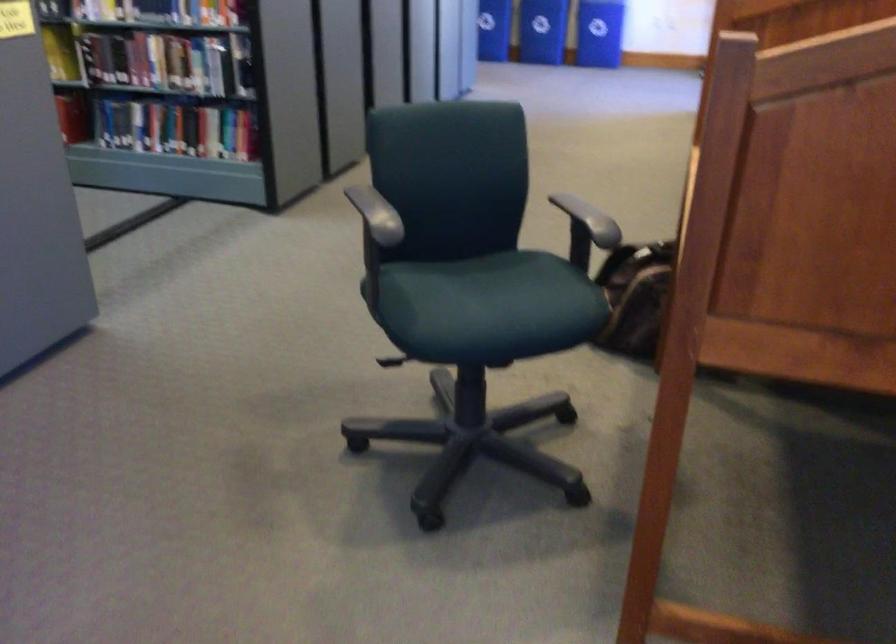
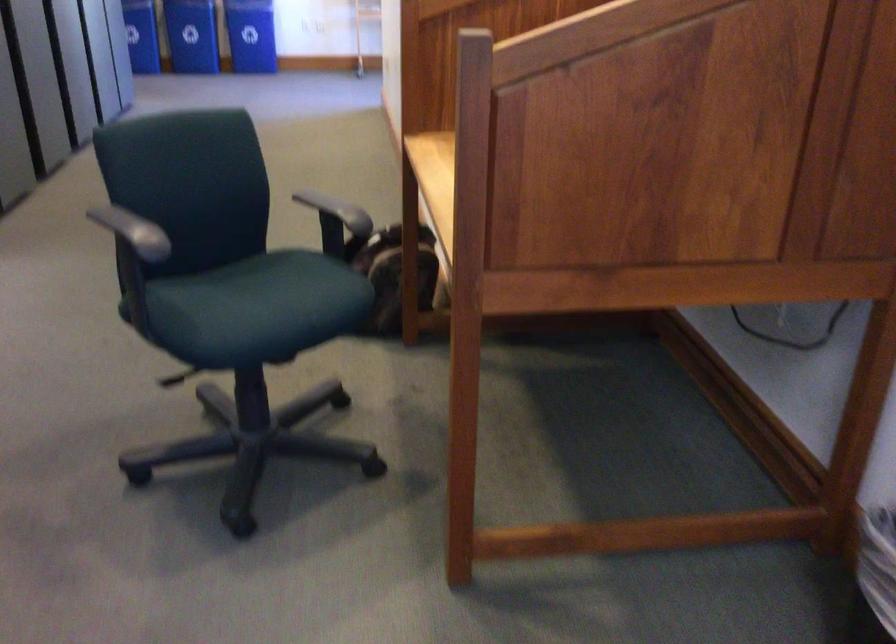
The images are taken continuously from a first-person perspective. In which direction are you moving?

The movement direction of the cameraman is left, backward.